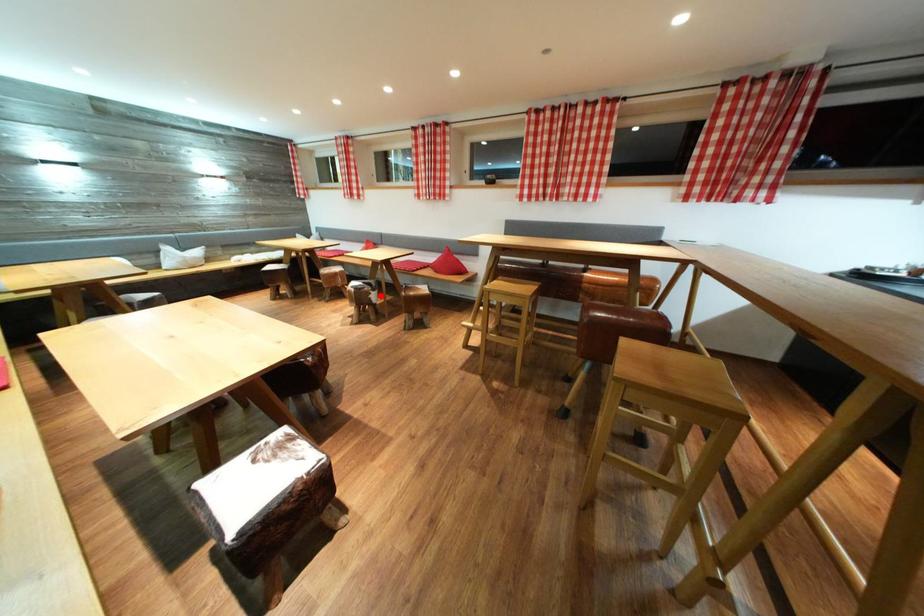
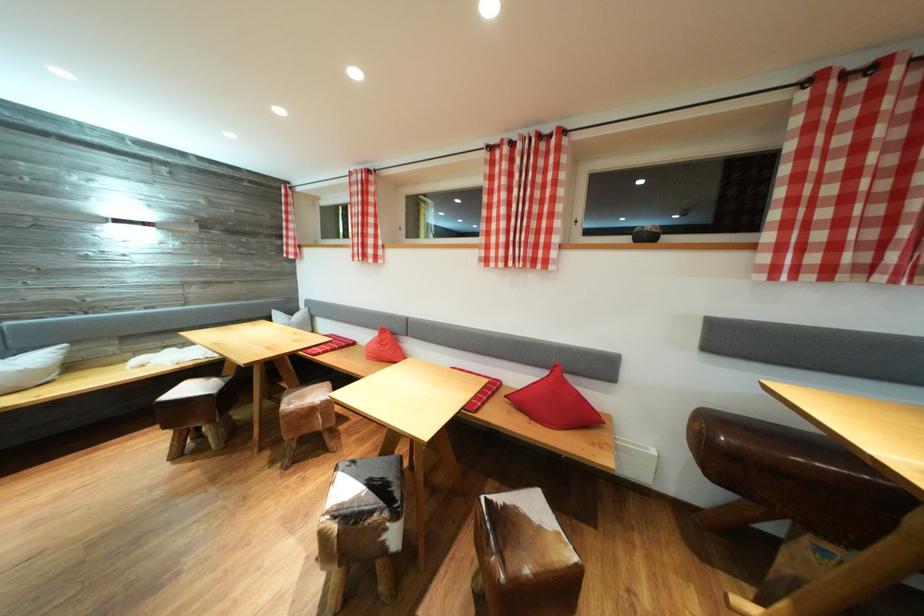
Find the pixel in the second image that matches the highlighted location in the first image.

(403, 522)